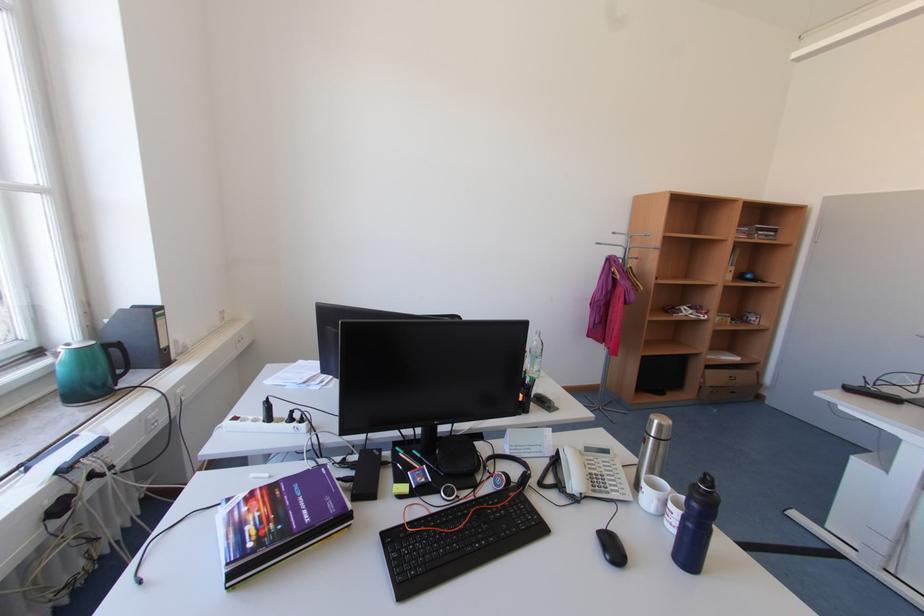
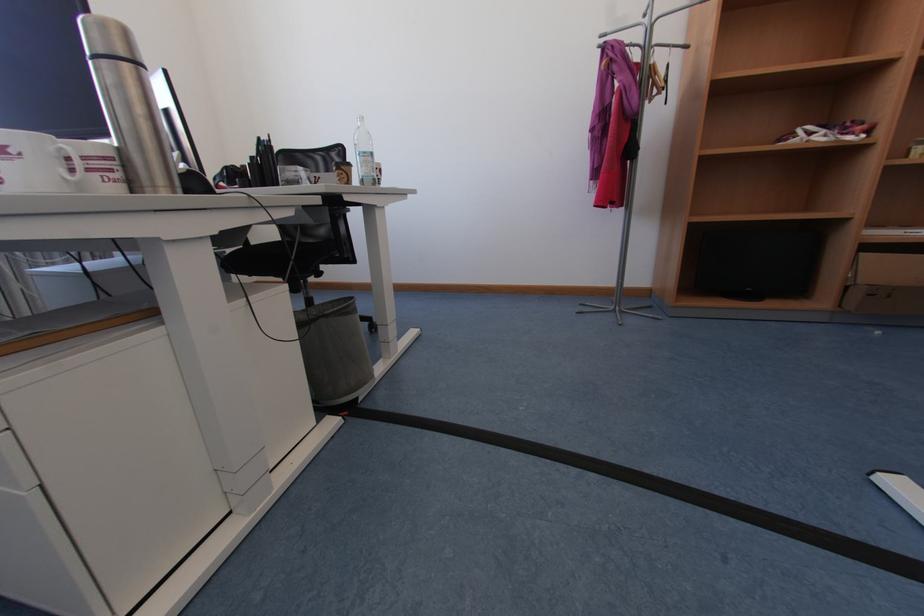
The point at (x=542, y=371) is marked in the first image. Where is the corresponding point in the second image?

(369, 177)